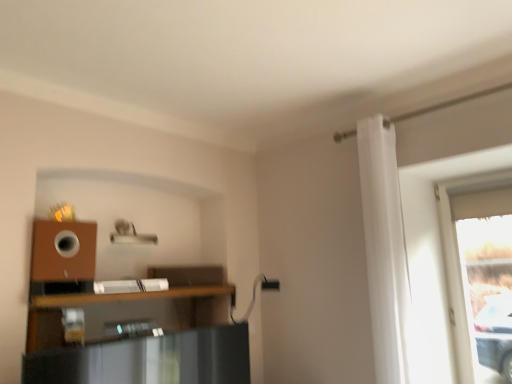
What do you see at coordinates (385, 250) in the screenshot?
I see `white fabric curtain at right` at bounding box center [385, 250].

Where is `white fabric curtain at right`? This screenshot has height=384, width=512. white fabric curtain at right is located at coordinates (385, 250).

Image resolution: width=512 pixels, height=384 pixels. Find the location of `window above the brown wooden shelf at lower left (from a real-world perspective)`. window above the brown wooden shelf at lower left (from a real-world perspective) is located at coordinates (458, 276).

From the image's perspective, is transparent glass window at right on top of brown wooden shelf at lower left?

Correct, transparent glass window at right appears higher than brown wooden shelf at lower left in the image.

Between transparent glass window at right and brown wooden shelf at lower left, which one has larger size?

transparent glass window at right is bigger.

Consider the image. Is transparent glass window at right looking in the opposite direction of brown wooden shelf at lower left?

transparent glass window at right is not turned away from brown wooden shelf at lower left.

Is brown wooden shelf at lower left touching white fabric curtain at right?

There is a gap between brown wooden shelf at lower left and white fabric curtain at right.

Is brown wooden shelf at lower left aimed at white fabric curtain at right?

No, brown wooden shelf at lower left is not aimed at white fabric curtain at right.

Is brown wooden shelf at lower left thinner than white fabric curtain at right?

In fact, brown wooden shelf at lower left might be wider than white fabric curtain at right.

From the image's perspective, which is above, brown wooden shelf at lower left or white fabric curtain at right?

white fabric curtain at right appears higher in the image.

Is point (442, 226) closer or farther from the camera than point (408, 320)?

Clearly, point (442, 226) is more distant from the camera than point (408, 320).

Is transparent glass window at right turned away from white fabric curtain at right?

No, transparent glass window at right is not facing the opposite direction of white fabric curtain at right.

Who is smaller, transparent glass window at right or white fabric curtain at right?

With smaller size is transparent glass window at right.

How different are the orientations of transparent glass window at right and white fabric curtain at right in degrees?

The angle between the facing direction of transparent glass window at right and the facing direction of white fabric curtain at right is 0.00103 degrees.

Considering the positions of objects white fabric curtain at right and brown wooden shelf at lower left in the image provided, who is more to the right, white fabric curtain at right or brown wooden shelf at lower left?

white fabric curtain at right is more to the right.

Between white fabric curtain at right and brown wooden shelf at lower left, which one is positioned in front?

Positioned in front is brown wooden shelf at lower left.

Image resolution: width=512 pixels, height=384 pixels. I want to click on shelf below the white fabric curtain at right (from a real-world perspective), so pos(129,296).

Is white fabric curtain at right turned away from brown wooden shelf at lower left?

No.

Who is shorter, brown wooden shelf at lower left or transparent glass window at right?

Standing shorter between the two is brown wooden shelf at lower left.

This screenshot has height=384, width=512. I want to click on shelf on the left of transparent glass window at right, so pos(129,296).

Does point (142, 297) lie in front of point (468, 301)?

Yes.

Is brown wooden shelf at lower left touching transparent glass window at right?

There is a gap between brown wooden shelf at lower left and transparent glass window at right.

Between white fabric curtain at right and transparent glass window at right, which one has larger size?

white fabric curtain at right is bigger.

Considering the positions of point (407, 376) and point (474, 176), is point (407, 376) closer or farther from the camera than point (474, 176)?

Point (407, 376) appears to be closer to the viewer than point (474, 176).

Which is correct: white fabric curtain at right is inside transparent glass window at right, or outside of it?

white fabric curtain at right is not enclosed by transparent glass window at right.

Considering the relative sizes of white fabric curtain at right and transparent glass window at right in the image provided, is white fabric curtain at right thinner than transparent glass window at right?

Incorrect, the width of white fabric curtain at right is not less than that of transparent glass window at right.

Locate an element on the screen. window above the brown wooden shelf at lower left (from a real-world perspective) is located at coordinates (458, 276).

You are a GUI agent. You are given a task and a screenshot of the screen. Output one action in this format:
    pyautogui.click(x=<x>, y=<y>)
    Task: Click on the curtain behind the brown wooden shelf at lower left
    The image size is (512, 384).
    Given the screenshot: What is the action you would take?
    pyautogui.click(x=385, y=250)

Based on their spatial positions, is brown wooden shelf at lower left or white fabric curtain at right further from transparent glass window at right?

brown wooden shelf at lower left is positioned further to the anchor transparent glass window at right.

Considering their positions, is white fabric curtain at right positioned closer to brown wooden shelf at lower left than transparent glass window at right?

white fabric curtain at right.

Estimate the real-world distances between objects in this image. Which object is closer to white fabric curtain at right, transparent glass window at right or brown wooden shelf at lower left?

transparent glass window at right is closer to white fabric curtain at right.

Considering their positions, is transparent glass window at right positioned closer to brown wooden shelf at lower left than white fabric curtain at right?

Among the two, white fabric curtain at right is located nearer to brown wooden shelf at lower left.

Consider the image. Based on their spatial positions, is white fabric curtain at right or brown wooden shelf at lower left closer to transparent glass window at right?

white fabric curtain at right is closer to transparent glass window at right.

Based on their spatial positions, is brown wooden shelf at lower left or transparent glass window at right closer to white fabric curtain at right?

transparent glass window at right is closer to white fabric curtain at right.

The height and width of the screenshot is (384, 512). I want to click on curtain situated between brown wooden shelf at lower left and transparent glass window at right from left to right, so click(385, 250).